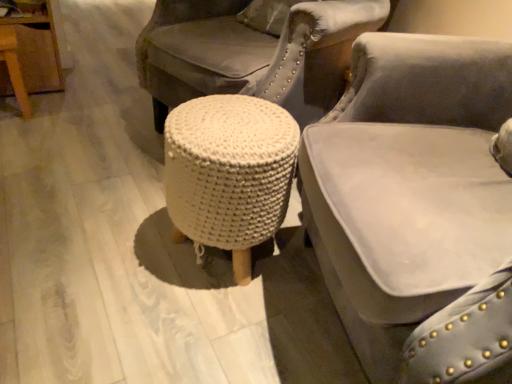
Question: Is white knitted stool at center beside velvet gray chair at center?

Choices:
 (A) no
 (B) yes

Answer: (A)

Question: From a real-world perspective, is white knitted stool at center over velvet gray chair at center?

Choices:
 (A) no
 (B) yes

Answer: (A)

Question: Can you confirm if white knitted stool at center is shorter than velvet gray chair at center?

Choices:
 (A) no
 (B) yes

Answer: (B)

Question: From the image's perspective, is white knitted stool at center located above velvet gray chair at center?

Choices:
 (A) yes
 (B) no

Answer: (A)

Question: Would you say velvet gray chair at center is part of white knitted stool at center's contents?

Choices:
 (A) no
 (B) yes

Answer: (A)

Question: Considering the relative sizes of white knitted stool at center and velvet gray chair at center in the image provided, is white knitted stool at center wider than velvet gray chair at center?

Choices:
 (A) yes
 (B) no

Answer: (B)

Question: Could you tell me if velvet gray chair at center is facing white knitted stool at center?

Choices:
 (A) yes
 (B) no

Answer: (A)

Question: Is velvet gray chair at center to the right of white knitted stool at center from the viewer's perspective?

Choices:
 (A) yes
 (B) no

Answer: (A)

Question: From the image's perspective, is velvet gray chair at center on top of white knitted stool at center?

Choices:
 (A) yes
 (B) no

Answer: (B)

Question: Considering the relative sizes of velvet gray chair at center and white knitted stool at center in the image provided, is velvet gray chair at center shorter than white knitted stool at center?

Choices:
 (A) no
 (B) yes

Answer: (A)

Question: Does velvet gray chair at center have a larger size compared to white knitted stool at center?

Choices:
 (A) no
 (B) yes

Answer: (B)

Question: Is white knitted stool at center a part of velvet gray chair at center?

Choices:
 (A) yes
 (B) no

Answer: (B)

Question: From a real-world perspective, is velvet gray chair at center physically located above or below white knitted stool at center?

Choices:
 (A) above
 (B) below

Answer: (A)